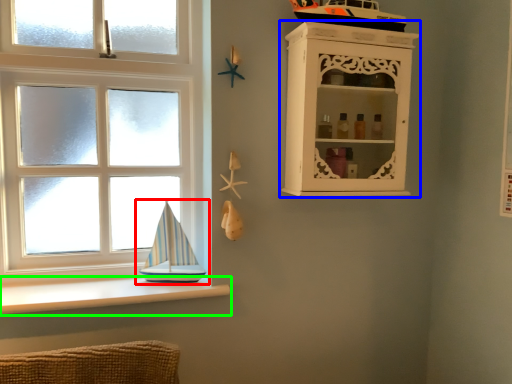
Question: Estimate the real-world distances between objects in this image. Which object is closer to boat (highlighted by a red box), shelf (highlighted by a blue box) or ledge (highlighted by a green box)?

Choices:
 (A) shelf
 (B) ledge

Answer: (B)